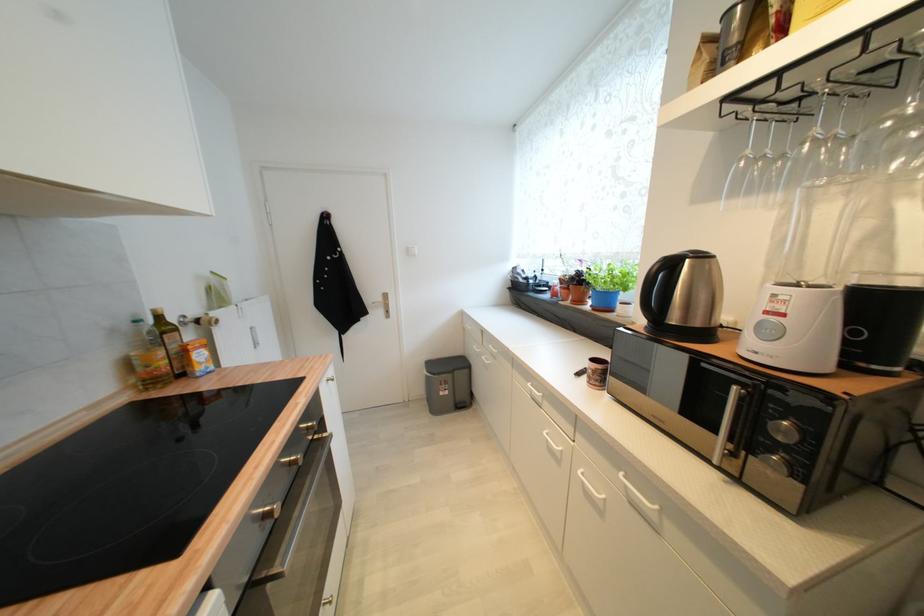
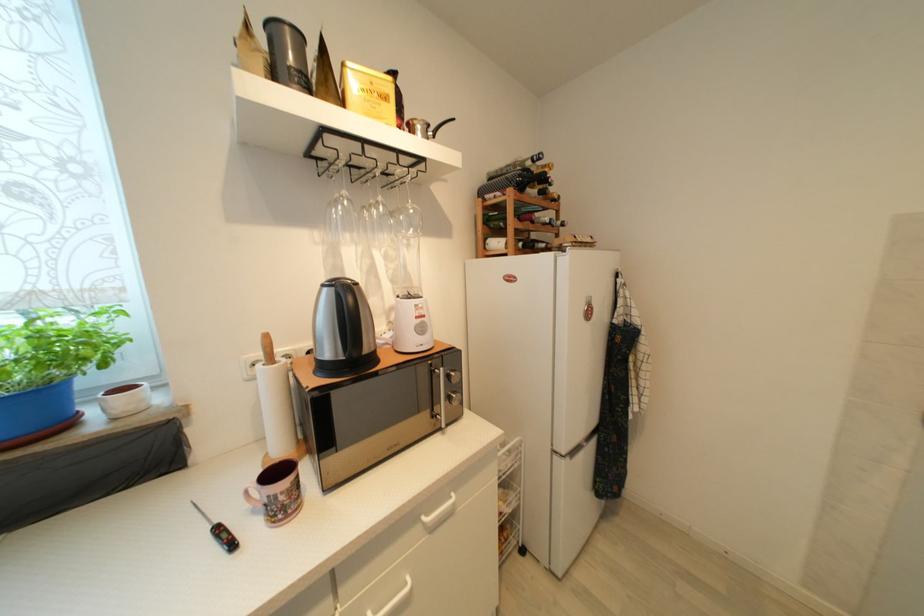
Where in the second image is the point corresponding to pixel 582 377 from the first image?

(237, 546)